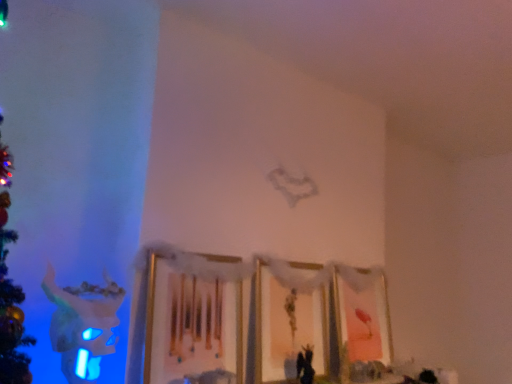
Question: Considering the positions of pink matte picture frame at lower right, acting as the first picture frame starting from the right, and wooden picture frame at center, which is counted as the third picture frame, starting from the right, in the image, is pink matte picture frame at lower right, acting as the first picture frame starting from the right, taller or shorter than wooden picture frame at center, which is counted as the third picture frame, starting from the right,?

Choices:
 (A) tall
 (B) short

Answer: (A)

Question: In the image, is pink matte picture frame at lower right, acting as the first picture frame starting from the right, on the left side or the right side of wooden picture frame at center, which is counted as the third picture frame, starting from the right?

Choices:
 (A) right
 (B) left

Answer: (A)

Question: Estimate the real-world distances between objects in this image. Which object is closer to the wooden picture frame at center, which is counted as the third picture frame, starting from the right?

Choices:
 (A) pink matte picture frame at lower right, acting as the first picture frame starting from the right
 (B) matte gold picture frame at center, the 2th picture frame when ordered from right to left

Answer: (B)

Question: Which is farther from the matte gold picture frame at center, the 2th picture frame when ordered from right to left?

Choices:
 (A) pink matte picture frame at lower right, the third picture frame from the left
 (B) wooden picture frame at center, placed as the first picture frame when sorted from left to right

Answer: (B)